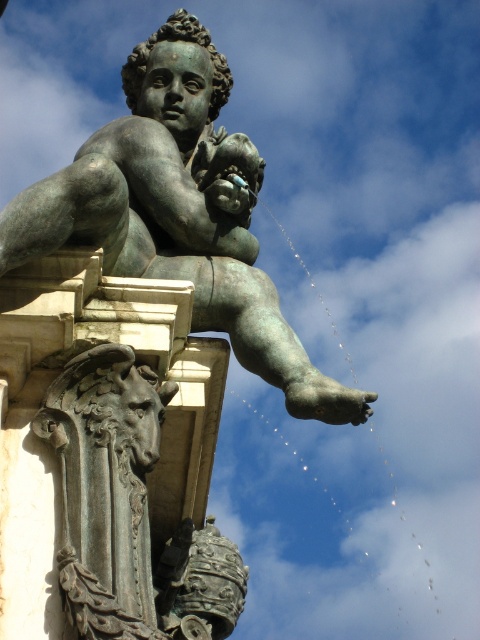
Question: Does green patina bronze statue at center come in front of dark gray stone horse head at lower left?

Choices:
 (A) no
 (B) yes

Answer: (A)

Question: Is green patina bronze statue at center to the right of dark gray stone horse head at lower left from the viewer's perspective?

Choices:
 (A) no
 (B) yes

Answer: (A)

Question: Is green patina bronze statue at center bigger than dark gray stone horse head at lower left?

Choices:
 (A) no
 (B) yes

Answer: (B)

Question: Among these objects, which one is nearest to the camera?

Choices:
 (A) green patina bronze statue at center
 (B) dark gray stone horse head at lower left

Answer: (B)

Question: Which of the following is the farthest from the observer?

Choices:
 (A) green patina bronze statue at center
 (B) dark gray stone horse head at lower left

Answer: (A)